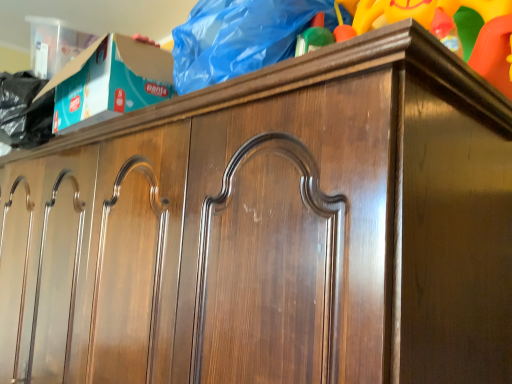
Question: Is wooden toy at upper right shorter than wooden cabinet at upper center?

Choices:
 (A) yes
 (B) no

Answer: (B)

Question: From a real-world perspective, is wooden toy at upper right beneath wooden cabinet at upper center?

Choices:
 (A) no
 (B) yes

Answer: (A)

Question: Is wooden toy at upper right oriented towards wooden cabinet at upper center?

Choices:
 (A) no
 (B) yes

Answer: (A)

Question: Is wooden toy at upper right not near wooden cabinet at upper center?

Choices:
 (A) no
 (B) yes

Answer: (A)

Question: Does wooden toy at upper right have a greater width compared to wooden cabinet at upper center?

Choices:
 (A) yes
 (B) no

Answer: (B)

Question: Is the position of wooden toy at upper right more distant than that of wooden cabinet at upper center?

Choices:
 (A) no
 (B) yes

Answer: (A)

Question: From a real-world perspective, does wooden cabinet at upper center stand above wooden toy at upper right?

Choices:
 (A) no
 (B) yes

Answer: (A)

Question: Is wooden cabinet at upper center with wooden toy at upper right?

Choices:
 (A) yes
 (B) no

Answer: (B)

Question: Can you confirm if wooden cabinet at upper center is bigger than wooden toy at upper right?

Choices:
 (A) no
 (B) yes

Answer: (B)

Question: Would you consider wooden cabinet at upper center to be distant from wooden toy at upper right?

Choices:
 (A) no
 (B) yes

Answer: (A)

Question: Is wooden toy at upper right at the back of wooden cabinet at upper center?

Choices:
 (A) no
 (B) yes

Answer: (A)

Question: Can you confirm if wooden cabinet at upper center is thinner than wooden toy at upper right?

Choices:
 (A) no
 (B) yes

Answer: (A)

Question: Is wooden toy at upper right spatially inside wooden cabinet at upper center, or outside of it?

Choices:
 (A) outside
 (B) inside

Answer: (A)